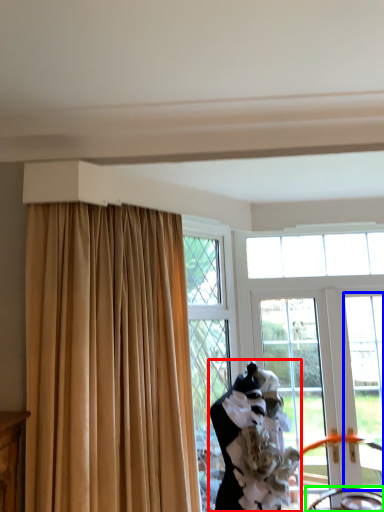
Question: Estimate the real-world distances between objects in this image. Which object is farther from woman (highlighted by a red box), window (highlighted by a blue box) or chair (highlighted by a green box)?

Choices:
 (A) window
 (B) chair

Answer: (A)